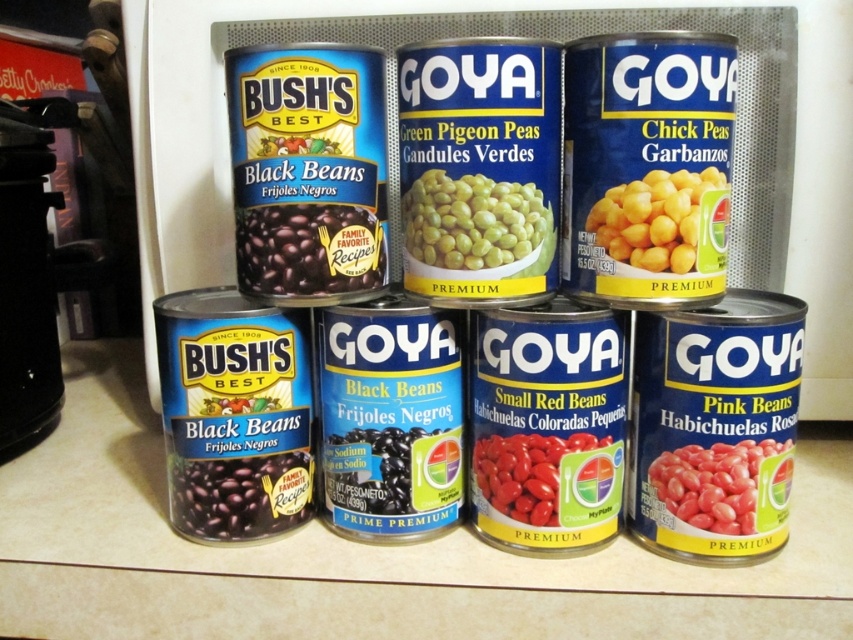
Does black matte/black beans at center have a lesser height compared to yellow matte chick peas at center right?

Yes, black matte/black beans at center is shorter than yellow matte chick peas at center right.

Based on the photo, is black matte/black beans at center taller than yellow matte chick peas at center right?

No.

Which is in front, point (306, 218) or point (675, 208)?

Point (675, 208) is in front.

This screenshot has width=853, height=640. I want to click on black matte/black beans at center, so click(308, 250).

Does black matte/black beans at center lie behind pink matte beans at lower right?

Yes, it is behind pink matte beans at lower right.

Can you confirm if black matte/black beans at center is positioned below pink matte beans at lower right?

Incorrect, black matte/black beans at center is not positioned below pink matte beans at lower right.

Who is more forward, (358,237) or (666,467)?

Positioned in front is point (666,467).

Image resolution: width=853 pixels, height=640 pixels. I want to click on black matte/black beans at center, so click(308, 250).

Which of these two, green matte peas at center or pink matte beans at lower right, stands shorter?

Standing shorter between the two is pink matte beans at lower right.

Consider the image. Does green matte peas at center appear over pink matte beans at lower right?

Correct, green matte peas at center is located above pink matte beans at lower right.

Between point (469, 262) and point (706, 520), which one is positioned behind?

Point (706, 520)

Locate an element on the screen. The image size is (853, 640). green matte peas at center is located at coordinates (474, 221).